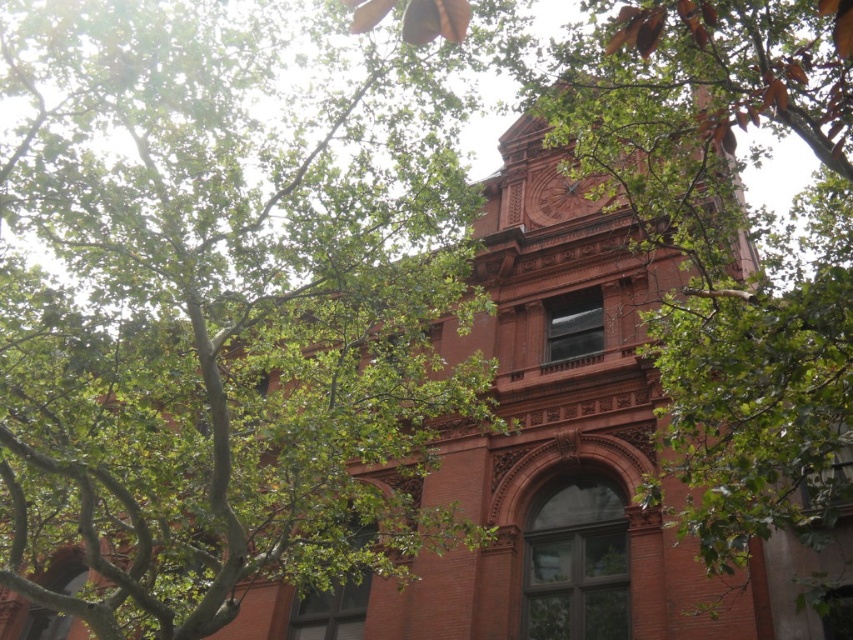
Question: Can you confirm if green leafy tree at upper center is positioned below matte brown clock at upper center?

Choices:
 (A) yes
 (B) no

Answer: (A)

Question: Which object appears farthest from the camera in this image?

Choices:
 (A) matte brown clock at upper center
 (B) green leafy tree at upper center

Answer: (A)

Question: Which of the following is the farthest from the observer?

Choices:
 (A) (567, 182)
 (B) (410, 497)

Answer: (A)

Question: Does green leafy tree at upper center have a smaller size compared to matte brown clock at upper center?

Choices:
 (A) no
 (B) yes

Answer: (A)

Question: Can you confirm if green leafy tree at upper center is positioned to the left of matte brown clock at upper center?

Choices:
 (A) no
 (B) yes

Answer: (B)